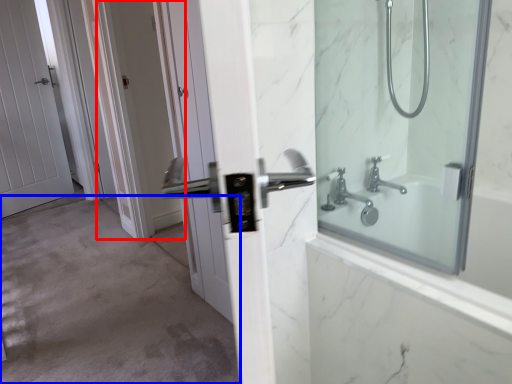
Question: Which of the following is the farthest to the observer, screen door (highlighted by a red box) or corridor (highlighted by a blue box)?

Choices:
 (A) screen door
 (B) corridor

Answer: (A)